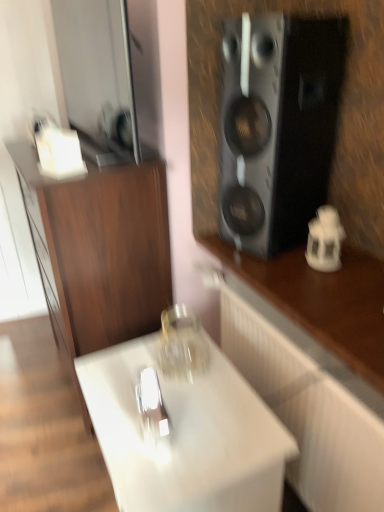
Question: Is point (213, 451) closer or farther from the camera than point (324, 121)?

Choices:
 (A) closer
 (B) farther

Answer: (A)

Question: Is white glossy table at center inside or outside of black matte speaker at upper right?

Choices:
 (A) outside
 (B) inside

Answer: (A)

Question: Which object is positioned closest to the white glossy cabinet at lower center, marked as the second cabinetry in a left-to-right arrangement?

Choices:
 (A) white porcelain lantern at right
 (B) black matte speaker at upper right
 (C) white glossy table at center
 (D) transparent glass jar at center
 (E) wooden cabinet at left, which is counted as the 2th cabinetry, starting from the right

Answer: (A)

Question: Which object is positioned closest to the transparent glass jar at center?

Choices:
 (A) white glossy cabinet at lower center, the 1th cabinetry in the right-to-left sequence
 (B) wooden cabinet at left, which appears as the 1th cabinetry when viewed from the left
 (C) black matte speaker at upper right
 (D) white glossy table at center
 (E) white porcelain lantern at right

Answer: (D)